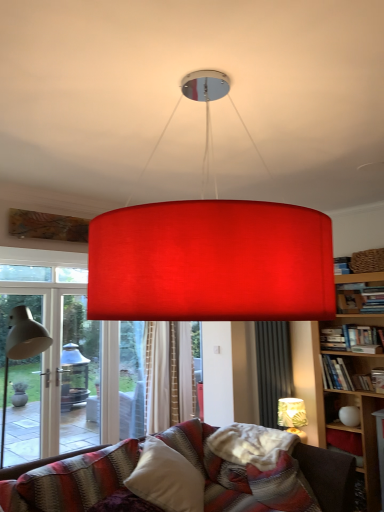
Measure the distance between matte red lampshade at center, which ranks as the 2th lamp in bottom-to-top order, and camera.

matte red lampshade at center, which ranks as the 2th lamp in bottom-to-top order, and camera are 1.19 meters apart from each other.

The height and width of the screenshot is (512, 384). I want to click on white textured lampshade at lower right, which ranks as the second lamp in left-to-right order, so click(292, 416).

This screenshot has width=384, height=512. I want to click on matte red lampshade at center, which is the second lamp in back-to-front order, so click(211, 262).

Would you say white textured lampshade at lower right, arranged as the second lamp when viewed from the top, is part of matte red lampshade at center, which ranks as the 2th lamp in bottom-to-top order,'s contents?

No, white textured lampshade at lower right, arranged as the second lamp when viewed from the top, is located outside of matte red lampshade at center, which ranks as the 2th lamp in bottom-to-top order.

Is point (192, 317) positioned behind point (285, 405)?

No, (192, 317) is in front of (285, 405).

Considering the sizes of objects matte red lampshade at center, the 2th lamp positioned from the right, and white textured lampshade at lower right, acting as the second lamp starting from the front, in the image provided, who is thinner, matte red lampshade at center, the 2th lamp positioned from the right, or white textured lampshade at lower right, acting as the second lamp starting from the front,?

white textured lampshade at lower right, acting as the second lamp starting from the front.

From the image's perspective, which one is positioned lower, white textured lampshade at lower right, arranged as the second lamp when viewed from the top, or matte white table lamp at left?

white textured lampshade at lower right, arranged as the second lamp when viewed from the top, is shown below in the image.

Can you confirm if white textured lampshade at lower right, the first lamp positioned from the right, is thinner than matte white table lamp at left?

Yes.

Who is more distant, white textured lampshade at lower right, which is the first lamp from back to front, or matte white table lamp at left?

white textured lampshade at lower right, which is the first lamp from back to front, is more distant.

Consider the image. From a real-world perspective, which is physically below, white textured lampshade at lower right, the first lamp positioned from the right, or matte white table lamp at left?

white textured lampshade at lower right, the first lamp positioned from the right.

Which of these two, matte white table lamp at left or white textured lampshade at lower right, the first lamp positioned from the right, stands shorter?

white textured lampshade at lower right, the first lamp positioned from the right.

Is matte white table lamp at left oriented away from white textured lampshade at lower right, which is the first lamp from back to front?

No, matte white table lamp at left is not facing away from white textured lampshade at lower right, which is the first lamp from back to front.

Which is in front, point (24, 347) or point (300, 426)?

Positioned in front is point (24, 347).

From the image's perspective, does matte white table lamp at left appear lower than white textured lampshade at lower right, arranged as the second lamp when viewed from the top?

Incorrect, from the image's perspective, matte white table lamp at left is higher than white textured lampshade at lower right, arranged as the second lamp when viewed from the top.

Is matte white table lamp at left positioned with its back to matte red lampshade at center, the 2th lamp positioned from the right?

No, matte white table lamp at left is not facing away from matte red lampshade at center, the 2th lamp positioned from the right.

How many degrees apart are the facing directions of matte white table lamp at left and matte red lampshade at center, which is the second lamp in back-to-front order?

The angle between the facing direction of matte white table lamp at left and the facing direction of matte red lampshade at center, which is the second lamp in back-to-front order, is 0.348 degrees.

Considering the positions of objects matte white table lamp at left and matte red lampshade at center, which ranks as the 2th lamp in bottom-to-top order, in the image provided, who is more to the right, matte white table lamp at left or matte red lampshade at center, which ranks as the 2th lamp in bottom-to-top order,?

matte red lampshade at center, which ranks as the 2th lamp in bottom-to-top order.

Does matte white table lamp at left have a smaller size compared to matte red lampshade at center, which appears as the first lamp when viewed from the front?

Yes, matte white table lamp at left is smaller than matte red lampshade at center, which appears as the first lamp when viewed from the front.

Considering the sizes of white textured lampshade at lower right, acting as the 1th lamp starting from the bottom, and matte red lampshade at center, the 2th lamp positioned from the right, in the image, is white textured lampshade at lower right, acting as the 1th lamp starting from the bottom, wider or thinner than matte red lampshade at center, the 2th lamp positioned from the right,?

In the image, white textured lampshade at lower right, acting as the 1th lamp starting from the bottom, appears to be more narrow than matte red lampshade at center, the 2th lamp positioned from the right.

Is white textured lampshade at lower right, acting as the second lamp starting from the front, next to matte red lampshade at center, which is the first lamp from left to right, and touching it?

No, white textured lampshade at lower right, acting as the second lamp starting from the front, is not touching matte red lampshade at center, which is the first lamp from left to right.

In the scene shown: Choose the correct answer: Is white textured lampshade at lower right, acting as the second lamp starting from the front, inside matte red lampshade at center, which is the second lamp in back-to-front order, or outside it?

white textured lampshade at lower right, acting as the second lamp starting from the front, exists outside the volume of matte red lampshade at center, which is the second lamp in back-to-front order.

Who is bigger, white textured lampshade at lower right, which is the first lamp from back to front, or matte red lampshade at center, which is the second lamp in back-to-front order?

With larger size is matte red lampshade at center, which is the second lamp in back-to-front order.

Which object is further away from the camera, matte red lampshade at center, which is the first lamp from left to right, or matte white table lamp at left?

matte white table lamp at left is further from the camera.

Between matte red lampshade at center, the 2th lamp positioned from the right, and matte white table lamp at left, which one appears on the left side from the viewer's perspective?

matte white table lamp at left.

This screenshot has height=512, width=384. In order to click on table lamp on the left of matte red lampshade at center, the 2th lamp positioned from the right in this screenshot , I will do `click(21, 349)`.

Is matte white table lamp at left located within matte red lampshade at center, which is the first lamp from left to right?

No, matte white table lamp at left is not surrounded by matte red lampshade at center, which is the first lamp from left to right.

The height and width of the screenshot is (512, 384). I want to click on lamp located below the matte red lampshade at center, which appears as the first lamp when viewed from the front (from the image's perspective), so click(292, 416).

I want to click on lamp that appears behind the matte white table lamp at left, so click(x=292, y=416).

From the image, which object appears to be nearer to matte white table lamp at left, white textured lampshade at lower right, arranged as the second lamp when viewed from the top, or matte red lampshade at center, which is the second lamp in back-to-front order?

matte red lampshade at center, which is the second lamp in back-to-front order, lies closer to matte white table lamp at left than the other object.

Estimate the real-world distances between objects in this image. Which object is further from matte white table lamp at left, matte red lampshade at center, which ranks as the 2th lamp in bottom-to-top order, or white textured lampshade at lower right, arranged as the second lamp when viewed from the top?

white textured lampshade at lower right, arranged as the second lamp when viewed from the top, is positioned further to the anchor matte white table lamp at left.

Which object lies further to the anchor point matte red lampshade at center, the 2th lamp positioned from the right, matte white table lamp at left or white textured lampshade at lower right, the first lamp positioned from the right?

The object further to matte red lampshade at center, the 2th lamp positioned from the right, is white textured lampshade at lower right, the first lamp positioned from the right.

When comparing their distances from white textured lampshade at lower right, acting as the second lamp starting from the front, does matte white table lamp at left or matte red lampshade at center, acting as the first lamp starting from the top, seem closer?

matte white table lamp at left.

Which object lies further to the anchor point matte red lampshade at center, which is the first lamp from left to right, white textured lampshade at lower right, which ranks as the second lamp in left-to-right order, or matte white table lamp at left?

Based on the image, white textured lampshade at lower right, which ranks as the second lamp in left-to-right order, appears to be further to matte red lampshade at center, which is the first lamp from left to right.

Which object lies nearer to the anchor point white textured lampshade at lower right, acting as the 1th lamp starting from the bottom, matte red lampshade at center, which is the first lamp from left to right, or matte white table lamp at left?

Based on the image, matte white table lamp at left appears to be nearer to white textured lampshade at lower right, acting as the 1th lamp starting from the bottom.

Find the location of `table lamp positioned between matte red lampshade at center, which is the first lamp from left to right, and white textured lampshade at lower right, acting as the 1th lamp starting from the bottom, from near to far`. table lamp positioned between matte red lampshade at center, which is the first lamp from left to right, and white textured lampshade at lower right, acting as the 1th lamp starting from the bottom, from near to far is located at coordinates (21, 349).